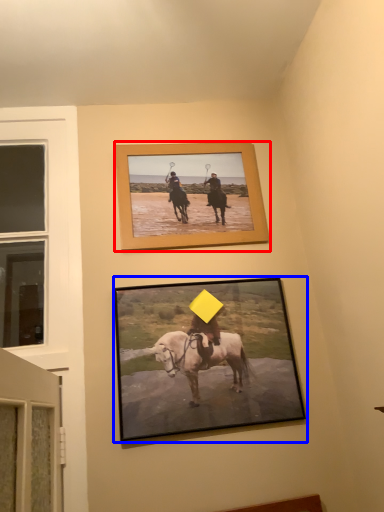
Question: Which point is further to the camera, picture frame (highlighted by a red box) or picture frame (highlighted by a blue box)?

Choices:
 (A) picture frame
 (B) picture frame

Answer: (A)